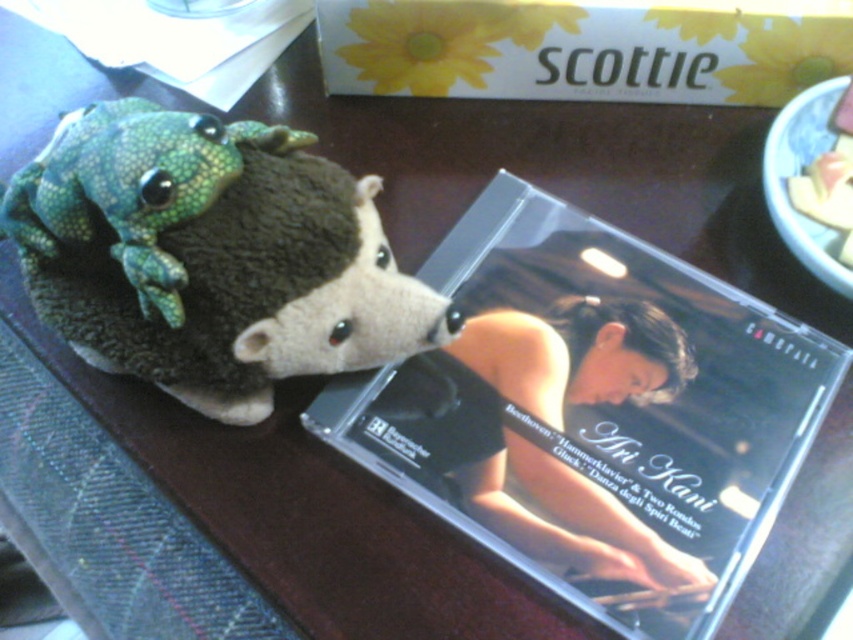
Based on the photo, you are looking at the CD case and the stuffed toy hedgehog on the table. There are two points marked on the table surface. One is at coordinates point (218, 403) and the other is at point (160, 284). From your viewpoint, which point is closer to you?

Point (160, 284) is closer to you because the description states that point (218, 403) is behind point (160, 284).

You are a small robot with a 2 inch wide arm. You need to pick up the green fuzzy plush toy at upper left and the green textured plush frog at upper left. Can your arm fit between them to grab both?

The distance between the green fuzzy plush toy at upper left and the green textured plush frog at upper left is 1.51 inches. Since your arm is 2 inches wide, it is wider than the space between them, so you cannot fit your arm between them to grab both.

You are organizing items on a table and need to place a new item between the clear plastic cd case at upper center and the green fuzzy plush toy at upper left. Can you do this without moving either of them?

The clear plastic cd case at upper center is positioned on the right side of green fuzzy plush toy at upper left, so there is space between them to place a new item without moving either of them.